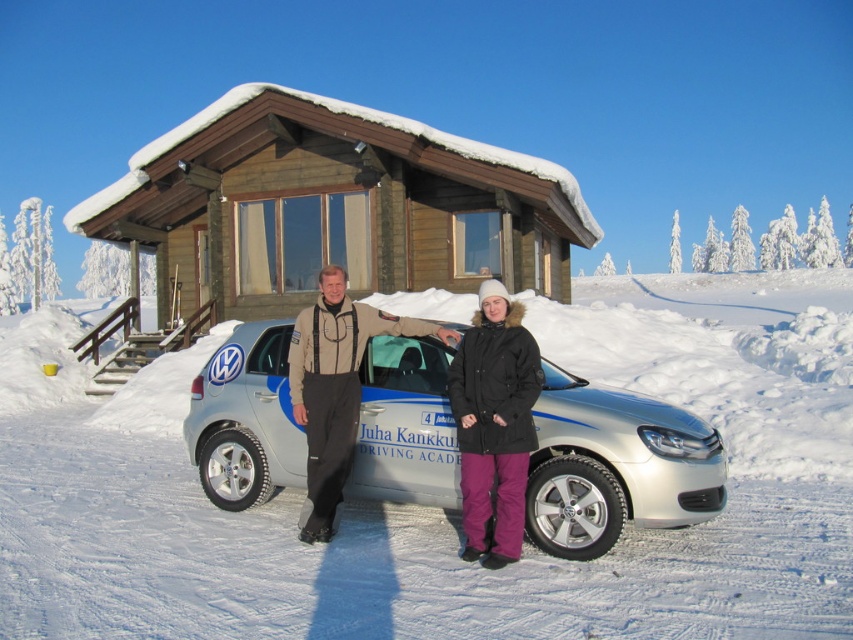
Question: Observing the image, what is the correct spatial positioning of wooden cabin at center in reference to purple fleece jacket at center?

Choices:
 (A) below
 (B) above

Answer: (B)

Question: Which object is positioned farthest from the silver metallic car at center?

Choices:
 (A) black woolen hat at center
 (B) purple fleece jacket at center
 (C) wooden cabin at center

Answer: (C)

Question: Which object is closer to the camera taking this photo?

Choices:
 (A) wooden cabin at center
 (B) purple fleece jacket at center

Answer: (B)

Question: Does white fluffy snow at center lie in front of silver metallic car at center?

Choices:
 (A) yes
 (B) no

Answer: (A)

Question: Estimate the real-world distances between objects in this image. Which object is closer to the white fluffy snow at center?

Choices:
 (A) wooden cabin at center
 (B) black woolen hat at center

Answer: (A)

Question: Is wooden cabin at center wider than silver metallic car at center?

Choices:
 (A) no
 (B) yes

Answer: (B)